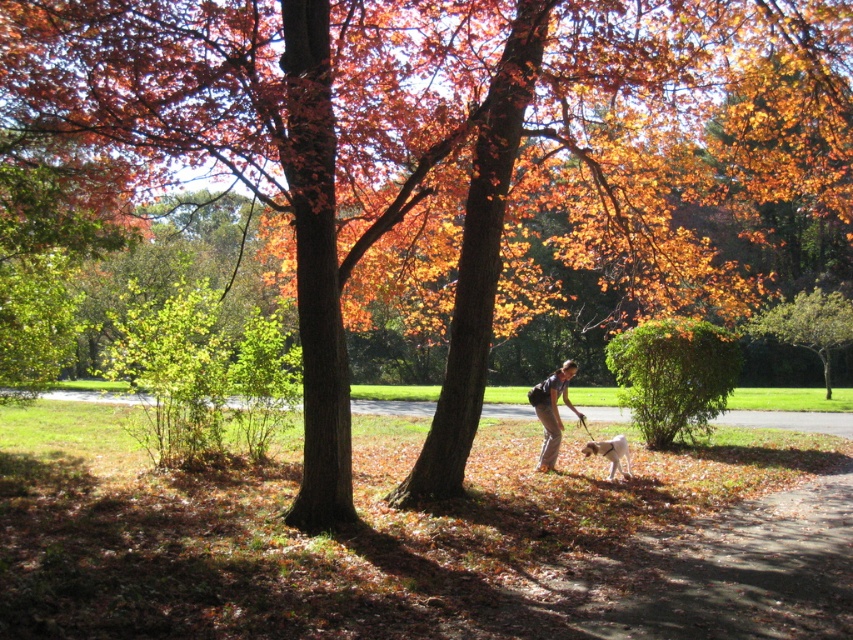
Is green leafy bush at center shorter than dark gray fabric pants at center?

No.

Does point (635, 385) come behind point (573, 365)?

Yes, it is.

Describe the element at coordinates (672, 376) in the screenshot. I see `green leafy bush at center` at that location.

I want to click on green leafy bush at center, so click(672, 376).

Does green leafy bush at center have a greater width compared to brown fur dog at lower center?

Correct, the width of green leafy bush at center exceeds that of brown fur dog at lower center.

Which is in front, point (648, 394) or point (630, 461)?

Point (630, 461) is more forward.

This screenshot has width=853, height=640. In order to click on green leafy bush at center in this screenshot , I will do coord(672,376).

You are a GUI agent. You are given a task and a screenshot of the screen. Output one action in this format:
    pyautogui.click(x=<x>, y=<y>)
    Task: Click on the green leafy bush at center
    This screenshot has width=853, height=640.
    Given the screenshot: What is the action you would take?
    pyautogui.click(x=672, y=376)

Between dark gray fabric pants at center and brown fur dog at lower center, which one is positioned lower?

brown fur dog at lower center

Who is positioned more to the left, dark gray fabric pants at center or brown fur dog at lower center?

dark gray fabric pants at center is more to the left.

Does point (537, 403) lie behind point (596, 444)?

Yes, it is behind point (596, 444).

Identify the location of dark gray fabric pants at center. (552, 412).